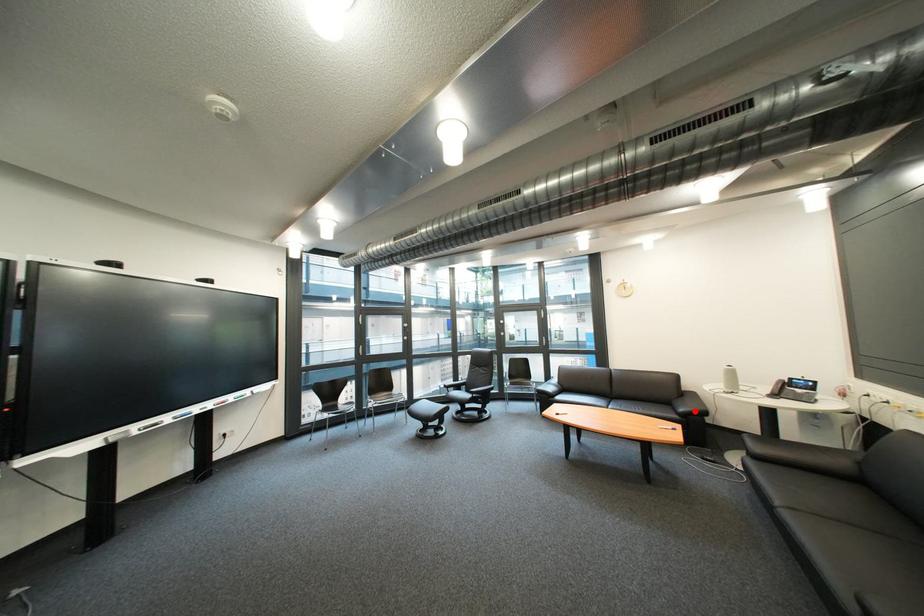
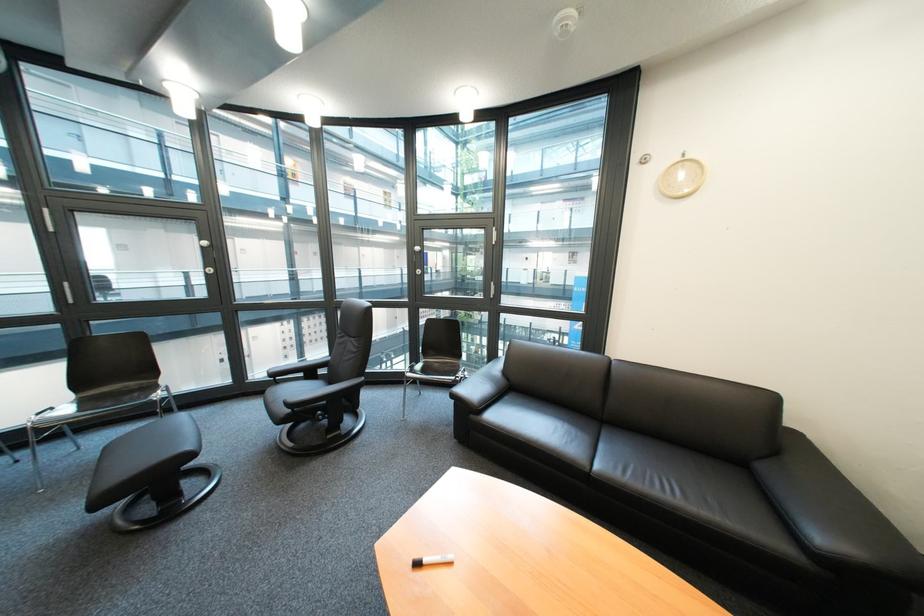
Question: I am providing you with two images of the same scene from different viewpoints. A red point is shown in image1. For the corresponding object point in image2, is it positioned nearer or farther from the camera?

Choices:
 (A) Nearer
 (B) Farther

Answer: (A)